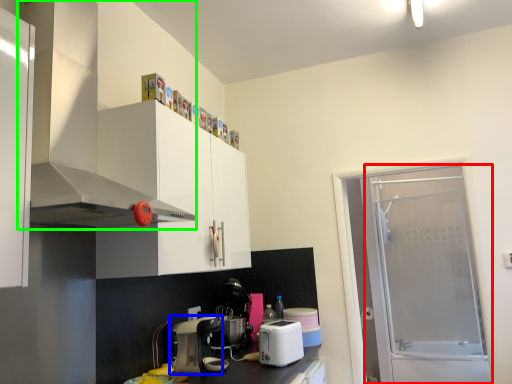
Question: Which object is positioned farthest from screen door (highlighted by a red box)? Select from kitchen appliance (highlighted by a blue box) and home appliance (highlighted by a green box).

Choices:
 (A) kitchen appliance
 (B) home appliance

Answer: (B)